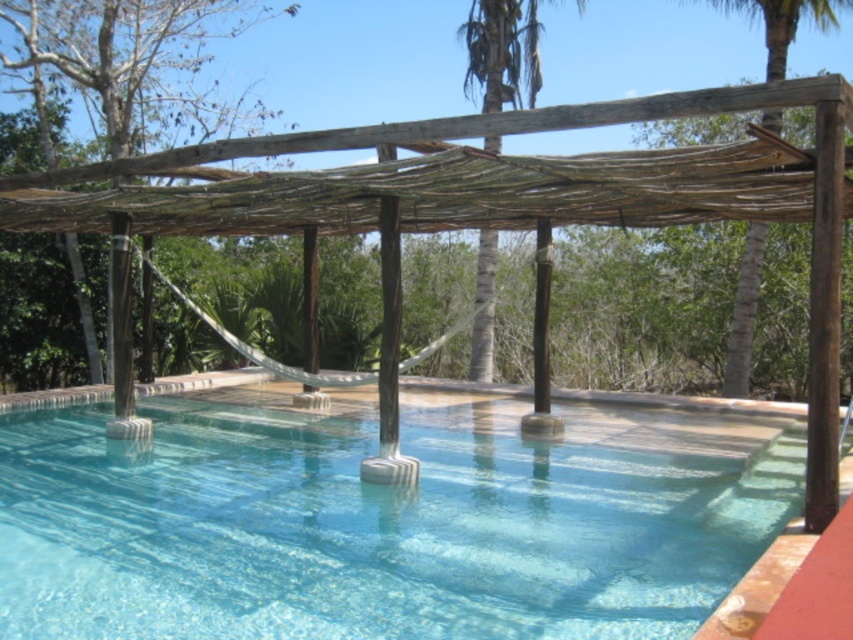
How distant is brown textured palm tree at center from brown wood palm tree at upper right?

brown textured palm tree at center and brown wood palm tree at upper right are 3.94 meters apart.

Is point (467, 67) less distant than point (764, 240)?

No, (467, 67) is further to viewer.

Locate an element on the screen. The image size is (853, 640). brown textured palm tree at center is located at coordinates (502, 52).

Find the location of `brown textured palm tree at center`. brown textured palm tree at center is located at coordinates (502, 52).

Which is below, green leafy tree at upper left or brown wood palm tree at upper right?

Positioned lower is brown wood palm tree at upper right.

Is green leafy tree at upper left below brown wood palm tree at upper right?

Actually, green leafy tree at upper left is above brown wood palm tree at upper right.

Is point (33, 36) positioned behind point (735, 356)?

Yes.

Locate an element on the screen. The image size is (853, 640). green leafy tree at upper left is located at coordinates (126, 58).

Does clear glass pool at center appear on the right side of brown wood palm tree at upper right?

Incorrect, clear glass pool at center is not on the right side of brown wood palm tree at upper right.

Can you confirm if clear glass pool at center is taller than brown wood palm tree at upper right?

No, clear glass pool at center is not taller than brown wood palm tree at upper right.

Who is more forward, (234, 444) or (747, 336)?

Point (234, 444) is more forward.

The width and height of the screenshot is (853, 640). Identify the location of clear glass pool at center. (384, 520).